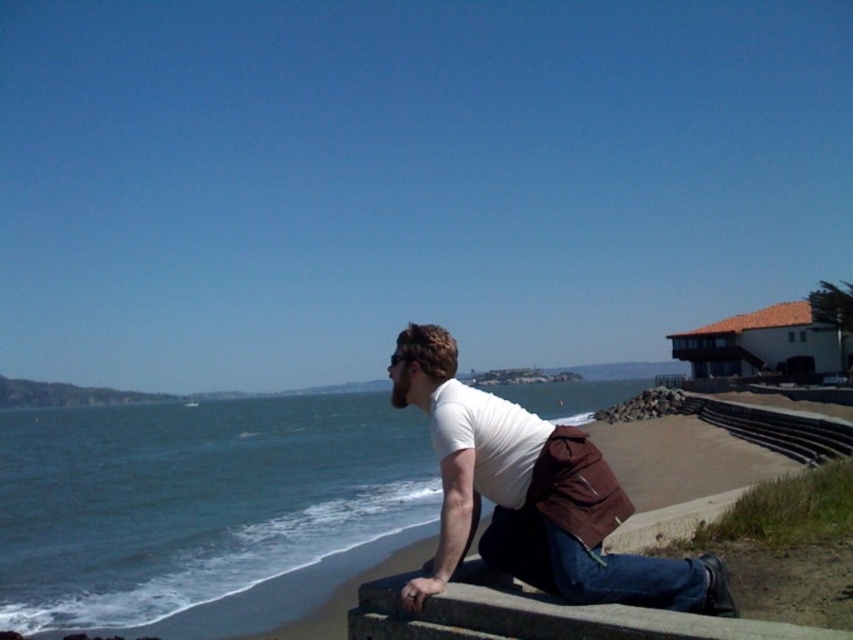
Question: Among these points, which one is nearest to the camera?

Choices:
 (A) (173, 444)
 (B) (552, 573)
 (C) (532, 531)
 (D) (404, 582)

Answer: (B)

Question: Which point is closer to the camera?

Choices:
 (A) gray concrete at lower center
 (B) blue denim jeans at lower center
 (C) blue water at lower left
 (D) white matte shirt at center

Answer: (A)

Question: Can you confirm if white matte shirt at center is positioned above blue denim jeans at lower center?

Choices:
 (A) yes
 (B) no

Answer: (A)

Question: Which of the following is the closest to the observer?

Choices:
 (A) (705, 598)
 (B) (396, 470)
 (C) (486, 616)

Answer: (C)

Question: Can you confirm if gray concrete at lower center is bigger than blue denim jeans at lower center?

Choices:
 (A) yes
 (B) no

Answer: (A)

Question: Can you confirm if white matte shirt at center is smaller than gray concrete at lower center?

Choices:
 (A) yes
 (B) no

Answer: (B)